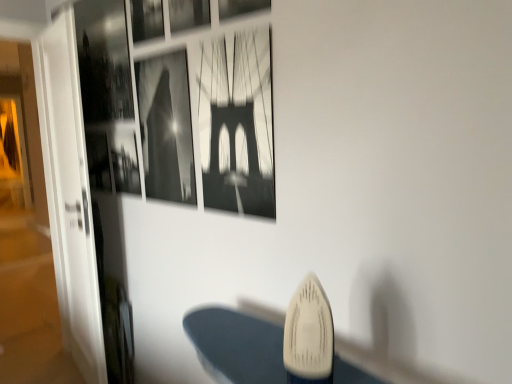
This screenshot has width=512, height=384. Describe the element at coordinates (309, 335) in the screenshot. I see `white plastic iron at lower center` at that location.

Image resolution: width=512 pixels, height=384 pixels. I want to click on metallic silver picture frame at upper center, the 5th picture frame viewed from the left, so click(241, 8).

Where is `transparent glass door at left`? This screenshot has width=512, height=384. transparent glass door at left is located at coordinates (69, 195).

Identify the location of metallic silver picture frame at upper center, which ranks as the third picture frame in left-to-right order. The image size is (512, 384). (188, 14).

Does white plastic iron at lower center contain metallic silver picture frame at upper center, which ranks as the third picture frame in left-to-right order?

No, metallic silver picture frame at upper center, which ranks as the third picture frame in left-to-right order, is not surrounded by white plastic iron at lower center.

Can you see white plastic iron at lower center touching metallic silver picture frame at upper center, the 3th picture frame when ordered from right to left?

white plastic iron at lower center and metallic silver picture frame at upper center, the 3th picture frame when ordered from right to left, are clearly separated.

Considering the relative sizes of white plastic iron at lower center and metallic silver picture frame at upper center, which ranks as the third picture frame in left-to-right order, in the image provided, is white plastic iron at lower center smaller than metallic silver picture frame at upper center, which ranks as the third picture frame in left-to-right order,?

No, white plastic iron at lower center is not smaller than metallic silver picture frame at upper center, which ranks as the third picture frame in left-to-right order.

Is metallic silver picture frame at upper center, which ranks as the third picture frame in left-to-right order, at the back of white plastic iron at lower center?

That's not correct — white plastic iron at lower center is not looking away from metallic silver picture frame at upper center, which ranks as the third picture frame in left-to-right order.

At what (x,y) coordinates should I click in order to perform the action: click on glass door on the left of black and white photograph at upper center, placed as the 4th picture frame when sorted from right to left. Please return your answer as a coordinate pair (x, y). The height and width of the screenshot is (384, 512). Looking at the image, I should click on (69, 195).

From the picture: Considering the sizes of objects transparent glass door at left and black and white photograph at upper center, placed as the 4th picture frame when sorted from right to left, in the image provided, who is taller, transparent glass door at left or black and white photograph at upper center, placed as the 4th picture frame when sorted from right to left,?

Standing taller between the two is transparent glass door at left.

Are transparent glass door at left and black and white photograph at upper center, placed as the 4th picture frame when sorted from right to left, located far from each other?

transparent glass door at left is actually quite close to black and white photograph at upper center, placed as the 4th picture frame when sorted from right to left.

Is transparent glass door at left completely or partially outside of black and white photograph at upper center, placed as the 4th picture frame when sorted from right to left?

Absolutely, transparent glass door at left is external to black and white photograph at upper center, placed as the 4th picture frame when sorted from right to left.

Which object is more forward, black and white photograph at upper center, the second picture frame in the left-to-right sequence, or transparent glass door at left?

black and white photograph at upper center, the second picture frame in the left-to-right sequence, is more forward.

Between black and white photograph at upper center, placed as the 4th picture frame when sorted from right to left, and transparent glass door at left, which one has larger size?

transparent glass door at left.

From the image's perspective, is black and white photograph at upper center, placed as the 4th picture frame when sorted from right to left, located above transparent glass door at left?

Yes.

Where is `glass door located underneath the black and white photograph at upper center, placed as the 4th picture frame when sorted from right to left (from a real-world perspective)`? glass door located underneath the black and white photograph at upper center, placed as the 4th picture frame when sorted from right to left (from a real-world perspective) is located at coordinates (69, 195).

Could you tell me if white plastic iron at lower center is facing metallic silver picture frame at upper center, the first picture frame positioned from the left?

No.

Can you confirm if white plastic iron at lower center is taller than metallic silver picture frame at upper center, the first picture frame positioned from the left?

In fact, white plastic iron at lower center may be shorter than metallic silver picture frame at upper center, the first picture frame positioned from the left.

Looking at their sizes, would you say white plastic iron at lower center is wider or thinner than metallic silver picture frame at upper center, which appears as the 5th picture frame when viewed from the right?

In the image, white plastic iron at lower center appears to be wider than metallic silver picture frame at upper center, which appears as the 5th picture frame when viewed from the right.

Considering the relative sizes of white plastic iron at lower center and metallic silver picture frame at upper center, the first picture frame positioned from the left, in the image provided, is white plastic iron at lower center bigger than metallic silver picture frame at upper center, the first picture frame positioned from the left,?

Correct, white plastic iron at lower center is larger in size than metallic silver picture frame at upper center, the first picture frame positioned from the left.

Who is bigger, metallic silver picture frame at upper center, which appears as the 1th picture frame when viewed from the right, or black and white photograph at upper center, placed as the 4th picture frame when sorted from right to left?

With larger size is black and white photograph at upper center, placed as the 4th picture frame when sorted from right to left.

Would you say metallic silver picture frame at upper center, the 5th picture frame viewed from the left, is inside or outside black and white photograph at upper center, the second picture frame in the left-to-right sequence?

metallic silver picture frame at upper center, the 5th picture frame viewed from the left, lies outside black and white photograph at upper center, the second picture frame in the left-to-right sequence.

Is white plastic iron at lower center completely or partially outside of metallic silver picture frame at upper center, which appears as the 1th picture frame when viewed from the right?

That's correct, white plastic iron at lower center is outside of metallic silver picture frame at upper center, which appears as the 1th picture frame when viewed from the right.

From a real-world perspective, is white plastic iron at lower center under metallic silver picture frame at upper center, which appears as the 1th picture frame when viewed from the right?

Yes, from a real-world perspective, white plastic iron at lower center is below metallic silver picture frame at upper center, which appears as the 1th picture frame when viewed from the right.

Image resolution: width=512 pixels, height=384 pixels. In order to click on picture frame that is the 5th one above the white plastic iron at lower center (from a real-world perspective) in this screenshot , I will do `click(241, 8)`.

Is metallic silver picture frame at upper center, the 5th picture frame viewed from the left, not inside metallic silver picture frame at upper center, the first picture frame positioned from the left?

Yes, metallic silver picture frame at upper center, the 5th picture frame viewed from the left, is not within metallic silver picture frame at upper center, the first picture frame positioned from the left.

Where is `the 2nd picture frame above the metallic silver picture frame at upper center, which appears as the 1th picture frame when viewed from the right (from the image's perspective)`? The width and height of the screenshot is (512, 384). the 2nd picture frame above the metallic silver picture frame at upper center, which appears as the 1th picture frame when viewed from the right (from the image's perspective) is located at coordinates (146, 19).

Considering the sizes of objects metallic silver picture frame at upper center, the 5th picture frame viewed from the left, and metallic silver picture frame at upper center, which appears as the 5th picture frame when viewed from the right, in the image provided, who is taller, metallic silver picture frame at upper center, the 5th picture frame viewed from the left, or metallic silver picture frame at upper center, which appears as the 5th picture frame when viewed from the right,?

metallic silver picture frame at upper center, which appears as the 5th picture frame when viewed from the right, is taller.

Which object is closer to the camera taking this photo, metallic silver picture frame at upper center, the 5th picture frame viewed from the left, or metallic silver picture frame at upper center, which appears as the 5th picture frame when viewed from the right?

metallic silver picture frame at upper center, the 5th picture frame viewed from the left, is more forward.

This screenshot has height=384, width=512. Identify the location of the 3rd picture frame directly above the white plastic iron at lower center (from a real-world perspective). [x=188, y=14].

In order to click on glass door below the black and white photograph at upper center, the second picture frame in the left-to-right sequence (from the image's perspective) in this screenshot , I will do `click(69, 195)`.

Looking at the image, which one is located closer to metallic silver picture frame at upper center, which ranks as the third picture frame in left-to-right order, black and white photograph at upper center, the second picture frame in the left-to-right sequence, or black paper at center, the second picture frame in the right-to-left sequence?

black and white photograph at upper center, the second picture frame in the left-to-right sequence.

Which object lies further to the anchor point black and white photograph at upper center, the second picture frame in the left-to-right sequence, white plastic iron at lower center or metallic silver picture frame at upper center, which appears as the 5th picture frame when viewed from the right?

The object further to black and white photograph at upper center, the second picture frame in the left-to-right sequence, is white plastic iron at lower center.

Considering their positions, is black and white photograph at upper center, the second picture frame in the left-to-right sequence, positioned further to white plastic iron at lower center than metallic silver picture frame at upper center, which appears as the 5th picture frame when viewed from the right?

metallic silver picture frame at upper center, which appears as the 5th picture frame when viewed from the right, is further to white plastic iron at lower center.

Which object lies nearer to the anchor point metallic silver picture frame at upper center, the first picture frame positioned from the left, metallic silver picture frame at upper center, which appears as the 1th picture frame when viewed from the right, or black paper at center, marked as the fourth picture frame in a left-to-right arrangement?

metallic silver picture frame at upper center, which appears as the 1th picture frame when viewed from the right, lies closer to metallic silver picture frame at upper center, the first picture frame positioned from the left, than the other object.

When comparing their distances from metallic silver picture frame at upper center, the first picture frame positioned from the left, does transparent glass door at left or metallic silver picture frame at upper center, which ranks as the third picture frame in left-to-right order, seem closer?

metallic silver picture frame at upper center, which ranks as the third picture frame in left-to-right order, lies closer to metallic silver picture frame at upper center, the first picture frame positioned from the left, than the other object.

From the picture: When comparing their distances from metallic silver picture frame at upper center, which ranks as the third picture frame in left-to-right order, does black paper at center, the second picture frame in the right-to-left sequence, or white plastic iron at lower center seem further?

white plastic iron at lower center is positioned further to the anchor metallic silver picture frame at upper center, which ranks as the third picture frame in left-to-right order.

Consider the image. When comparing their distances from white plastic iron at lower center, does metallic silver picture frame at upper center, the 5th picture frame viewed from the left, or black and white photograph at upper center, the second picture frame in the left-to-right sequence, seem further?

black and white photograph at upper center, the second picture frame in the left-to-right sequence, lies further to white plastic iron at lower center than the other object.

When comparing their distances from metallic silver picture frame at upper center, which appears as the 1th picture frame when viewed from the right, does metallic silver picture frame at upper center, which ranks as the third picture frame in left-to-right order, or black and white photograph at upper center, the second picture frame in the left-to-right sequence, seem further?

Among the two, black and white photograph at upper center, the second picture frame in the left-to-right sequence, is located further to metallic silver picture frame at upper center, which appears as the 1th picture frame when viewed from the right.

I want to click on picture frame between metallic silver picture frame at upper center, the 5th picture frame viewed from the left, and black paper at center, marked as the fourth picture frame in a left-to-right arrangement, in the vertical direction, so click(166, 127).

The height and width of the screenshot is (384, 512). In order to click on picture frame that lies between metallic silver picture frame at upper center, which ranks as the third picture frame in left-to-right order, and black and white photograph at upper center, the second picture frame in the left-to-right sequence, from top to bottom in this screenshot , I will do (x=241, y=8).